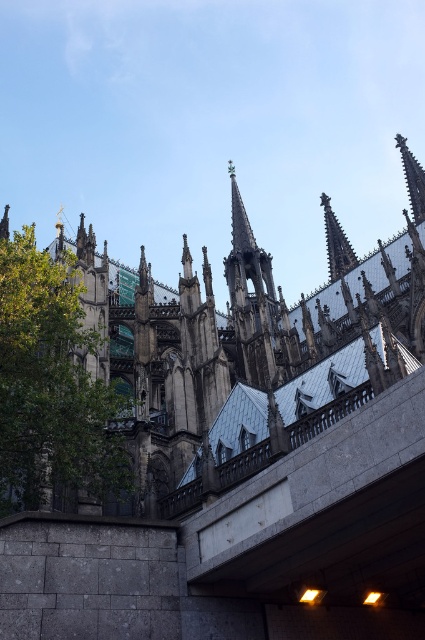
Looking at this image, does green leafy tree at left have a greater width compared to dark gray stone spire at center?

Yes, green leafy tree at left is wider than dark gray stone spire at center.

Who is shorter, green leafy tree at left or dark gray stone spire at center?

Standing shorter between the two is green leafy tree at left.

Does point (48, 260) come farther from viewer compared to point (252, 292)?

No.

Locate an element on the screen. The image size is (425, 640). green leafy tree at left is located at coordinates (51, 385).